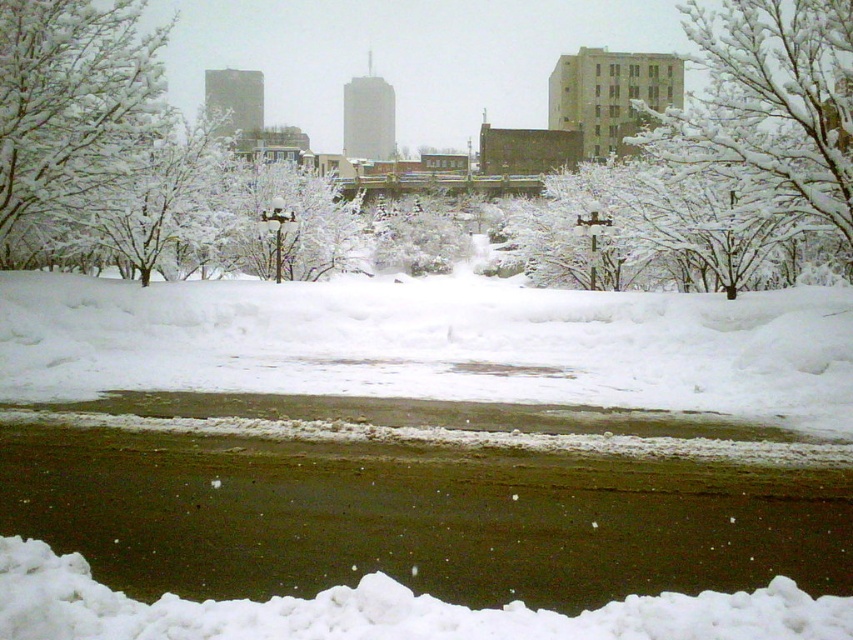
Can you confirm if white frosty tree at upper center is smaller than snow-covered branches at upper right?

No, white frosty tree at upper center is not smaller than snow-covered branches at upper right.

Measure the distance between point (19, 221) and camera.

They are 22.97 meters apart.

Is point (412, 99) farther from camera compared to point (799, 177)?

Yes, it is.

I want to click on white frosty tree at upper center, so click(70, 100).

Can you confirm if white frosty branches at upper left is positioned above snow-covered branches at upper right?

Yes, white frosty branches at upper left is above snow-covered branches at upper right.

From the picture: Who is more forward, (103, 161) or (758, 113)?

Positioned in front is point (758, 113).

Image resolution: width=853 pixels, height=640 pixels. What are the coordinates of `white frosty branches at upper left` in the screenshot? It's located at (71, 113).

Between white frosty tree at upper center and white frosty branches at upper left, which one appears on the left side from the viewer's perspective?

white frosty branches at upper left is more to the left.

The height and width of the screenshot is (640, 853). What do you see at coordinates (70, 100) in the screenshot?
I see `white frosty tree at upper center` at bounding box center [70, 100].

Is point (393, 17) in front of point (137, 49)?

No, (393, 17) is further to viewer.

Find the location of a particular element. This screenshot has height=640, width=853. white frosty tree at upper center is located at coordinates (70, 100).